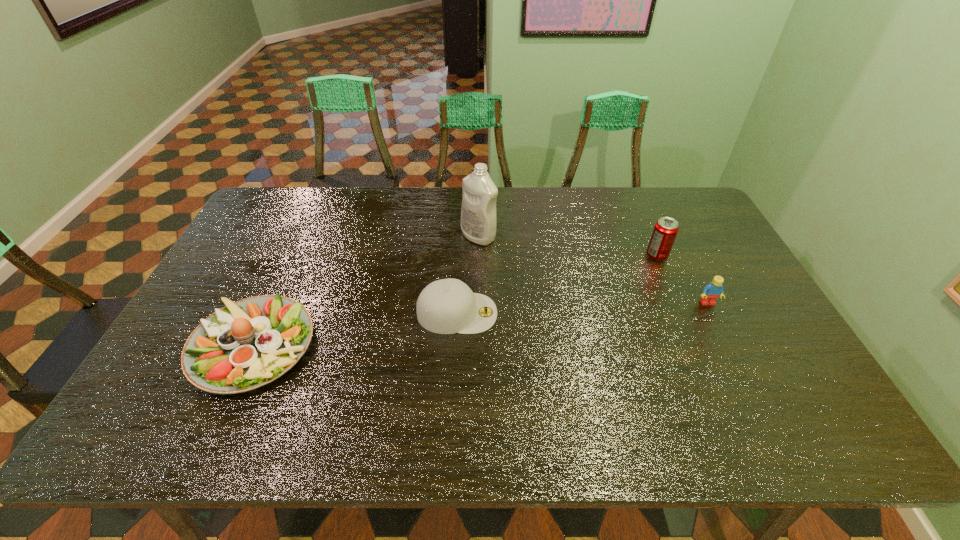
Where is `free space in the image that satisfies the following two spatial constraints: 1. on the face of the rightmost object; 2. on the front-facing side of the cap`? Image resolution: width=960 pixels, height=540 pixels. free space in the image that satisfies the following two spatial constraints: 1. on the face of the rightmost object; 2. on the front-facing side of the cap is located at coordinates (712, 313).

Where is `free space that satisfies the following two spatial constraints: 1. on the front side of the fourth object from left to right; 2. on the left side of the tallest object`? The height and width of the screenshot is (540, 960). free space that satisfies the following two spatial constraints: 1. on the front side of the fourth object from left to right; 2. on the left side of the tallest object is located at coordinates (478, 255).

The width and height of the screenshot is (960, 540). I want to click on free point that satisfies the following two spatial constraints: 1. on the face of the Lego; 2. on the front-facing side of the cap, so click(712, 313).